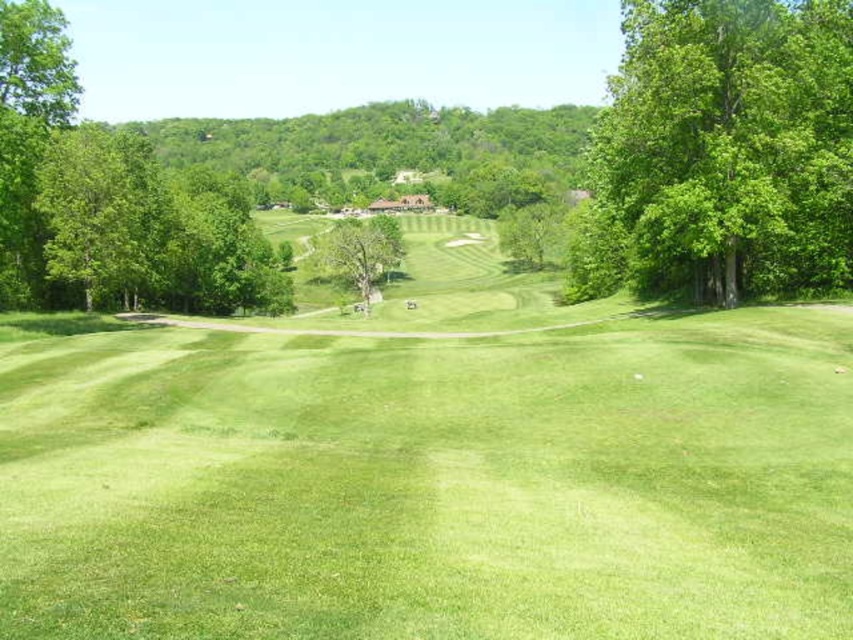
Does green leafy tree at right appear over green leafy tree at center?

Incorrect, green leafy tree at right is not positioned above green leafy tree at center.

From the picture: Is green leafy tree at right smaller than green leafy tree at center?

Indeed, green leafy tree at right has a smaller size compared to green leafy tree at center.

Between point (822, 248) and point (335, 221), which one is positioned behind?

The point (335, 221) is more distant.

I want to click on green leafy tree at right, so click(723, 150).

Can you confirm if green grassy field at center is smaller than green leafy tree at center?

Yes.

Is point (525, 445) more distant than point (373, 296)?

No, (525, 445) is in front of (373, 296).

The height and width of the screenshot is (640, 853). Identify the location of green grassy field at center. (430, 468).

Who is more forward, (x=242, y=611) or (x=648, y=77)?

Point (x=242, y=611)

You are a GUI agent. You are given a task and a screenshot of the screen. Output one action in this format:
    pyautogui.click(x=<x>, y=<y>)
    Task: Click on the green grassy field at center
    Image resolution: width=853 pixels, height=640 pixels.
    Given the screenshot: What is the action you would take?
    pyautogui.click(x=430, y=468)

I want to click on green grassy field at center, so click(430, 468).